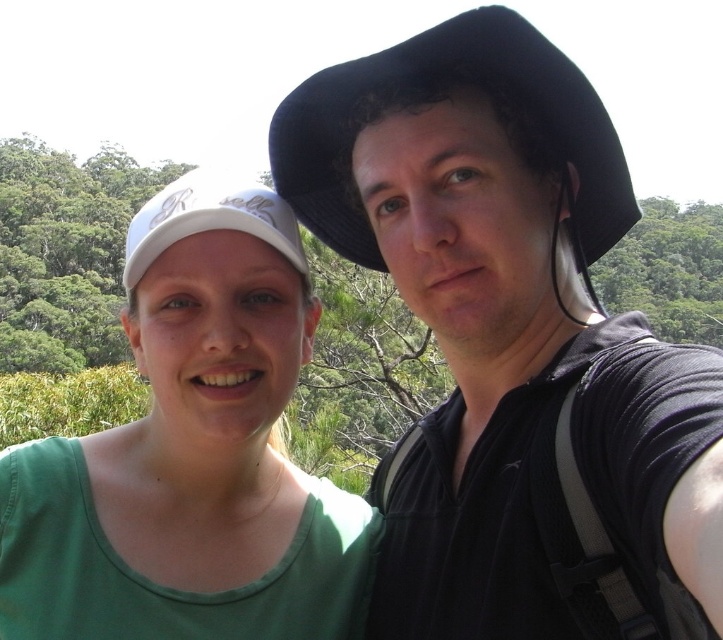
From the picture: You are a photographer trying to capture a clear shot of both the green fabric shirt at left and the black fabric cowboy hat at upper center. Which object should you focus on first to ensure it appears sharp in the photo?

You should focus on the green fabric shirt at left first because it is closer to you than the black fabric cowboy hat at upper center, so focusing on the closer object ensures it will be sharp, and the farther object may also be in focus depending on depth of field.

You are a photographer trying to frame a shot of the green fabric shirt at left and the white matte cap at center. Which object should you focus on first if you want to capture both in the same frame without moving the camera?

The green fabric shirt at left has a lesser height compared to the white matte cap at center, so you should focus on the white matte cap at center first to ensure both are in the frame.

You are a photographer trying to capture a clear shot of the green fabric shirt at left and the black fabric cowboy hat at upper center. Given their sizes, which object should you zoom in on more to ensure both are equally visible in the frame?

The green fabric shirt at left is smaller than the black fabric cowboy hat at upper center, so you should zoom in more on the green fabric shirt at left to balance their visibility in the frame.